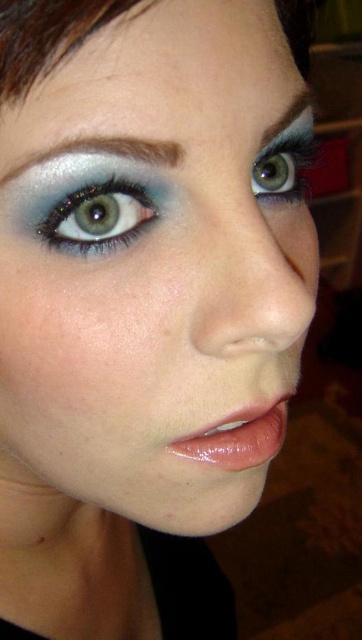
Is shimmering teal eye at center shorter than glossy pink lipstick at lower center?

Yes.

What do you see at coordinates (98, 216) in the screenshot?
I see `shimmering teal eye at center` at bounding box center [98, 216].

Is point (132, 208) positioned before point (237, 436)?

Yes, it is in front of point (237, 436).

Identify the location of shimmering teal eye at center. This screenshot has height=640, width=362. (98, 216).

Based on the photo, can you confirm if brown matte hair at upper left is positioned above smokey gray eyebrow at upper left?

Indeed, brown matte hair at upper left is positioned over smokey gray eyebrow at upper left.

Does point (300, 3) come behind point (181, 154)?

Yes, point (300, 3) is farther from viewer.

Measure the distance between brown matte hair at upper left and camera.

brown matte hair at upper left and camera are 6.72 inches apart.

Locate an element on the screen. The width and height of the screenshot is (362, 640). brown matte hair at upper left is located at coordinates (45, 35).

Which is below, shimmering teal eye at center or smokey gray eyebrow at upper center?

shimmering teal eye at center

Which of these two, shimmering teal eye at center or smokey gray eyebrow at upper center, stands shorter?

Standing shorter between the two is shimmering teal eye at center.

What do you see at coordinates (98, 216) in the screenshot? I see `shimmering teal eye at center` at bounding box center [98, 216].

You are a GUI agent. You are given a task and a screenshot of the screen. Output one action in this format:
    pyautogui.click(x=<x>, y=<y>)
    Task: Click on the shimmering teal eye at center
    This screenshot has height=640, width=362.
    Given the screenshot: What is the action you would take?
    pyautogui.click(x=98, y=216)